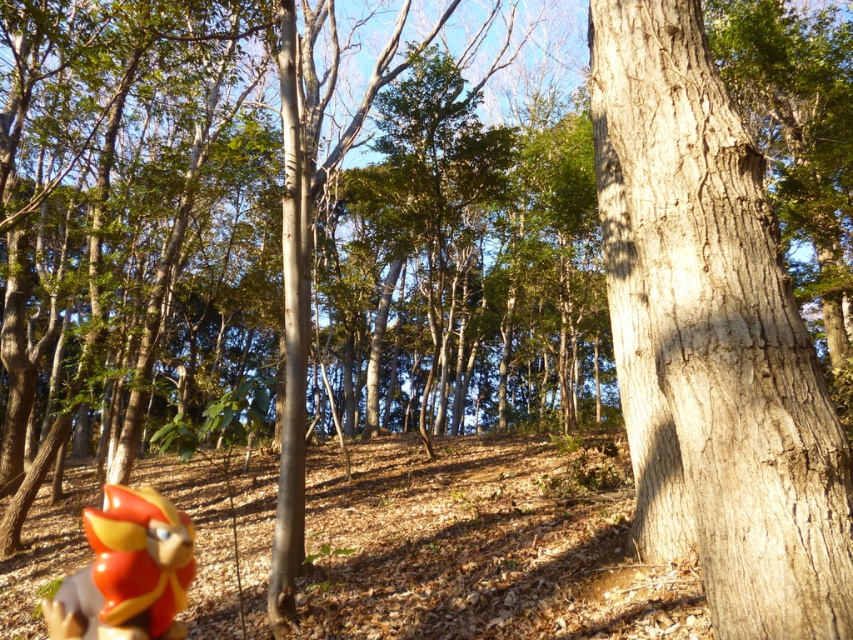
Question: Which of the following is the closest to the observer?

Choices:
 (A) (136, 600)
 (B) (724, 145)

Answer: (B)

Question: Is smooth gray bark at right to the left of shiny plastic bird at lower left from the viewer's perspective?

Choices:
 (A) yes
 (B) no

Answer: (B)

Question: Does smooth gray bark at right come in front of shiny plastic bird at lower left?

Choices:
 (A) yes
 (B) no

Answer: (A)

Question: Is smooth gray bark at right positioned before shiny plastic bird at lower left?

Choices:
 (A) no
 (B) yes

Answer: (B)